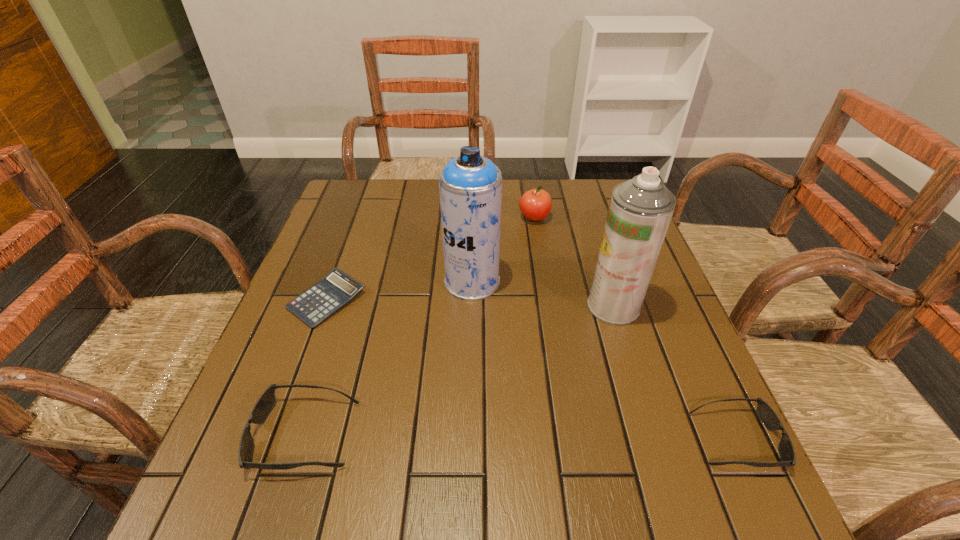
Locate an element on the screen. vacant space located on the left of the fourth object from left to right is located at coordinates (388, 218).

What are the coordinates of `free spot located 0.140m on the back of the right aerosol can` in the screenshot? It's located at (597, 252).

Find the location of a particular element. blank space located 0.220m on the left of the left aerosol can is located at coordinates (355, 281).

Where is `object that is at the far edge`? object that is at the far edge is located at coordinates (535, 205).

This screenshot has width=960, height=540. What are the coordinates of `sunglasses that is at the left edge` in the screenshot? It's located at (266, 402).

What are the coordinates of `calculator that is at the left edge` in the screenshot? It's located at (336, 289).

Find the location of a particular element. sunglasses present at the right edge is located at coordinates (765, 413).

You are a GUI agent. You are given a task and a screenshot of the screen. Output one action in this format:
    pyautogui.click(x=<x>, y=<y>)
    Task: Click on the aerosol can at the right edge
    
    Given the screenshot: What is the action you would take?
    pyautogui.click(x=640, y=210)

Identify the location of object that is at the near left corner. (266, 402).

At what (x,y) coordinates should I click in order to perform the action: click on object present at the near right corner. Please return your answer as a coordinate pair (x, y). Image resolution: width=960 pixels, height=540 pixels. Looking at the image, I should click on (765, 413).